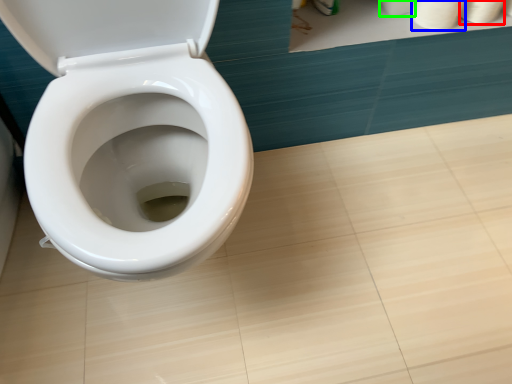
Question: Based on their relative distances, which object is nearer to toilet paper (highlighted by a red box)? Choose from toilet paper (highlighted by a blue box) and toilet paper (highlighted by a green box).

Choices:
 (A) toilet paper
 (B) toilet paper

Answer: (A)